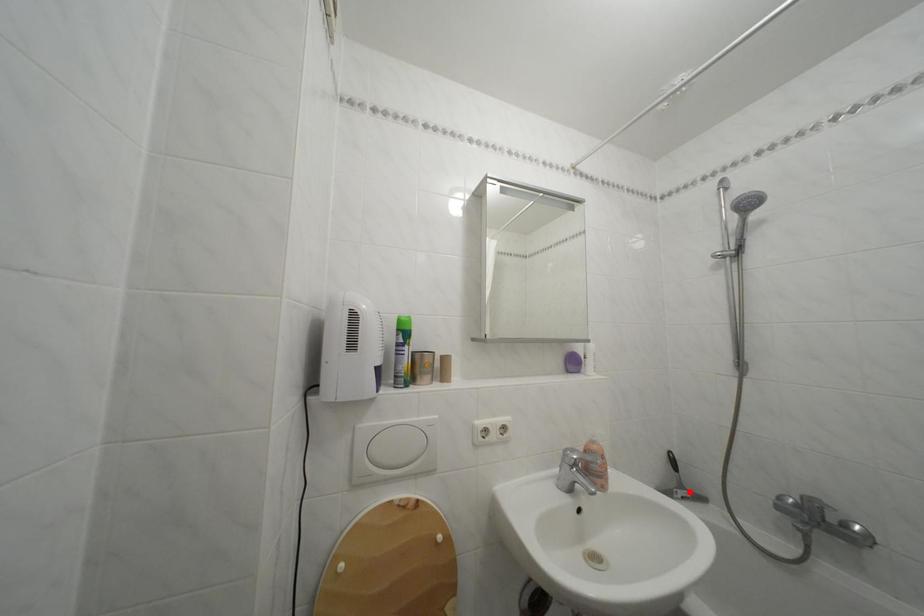
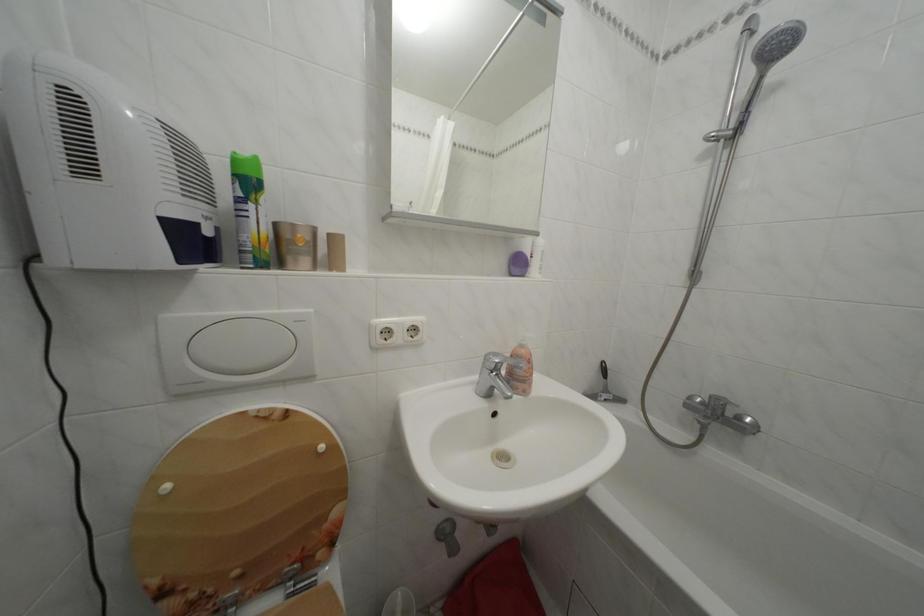
Question: I am providing you with two images of the same scene from different viewpoints. A red point is marked on the first image. Is the red point's position out of view in image 2?

Choices:
 (A) Yes
 (B) No

Answer: (B)